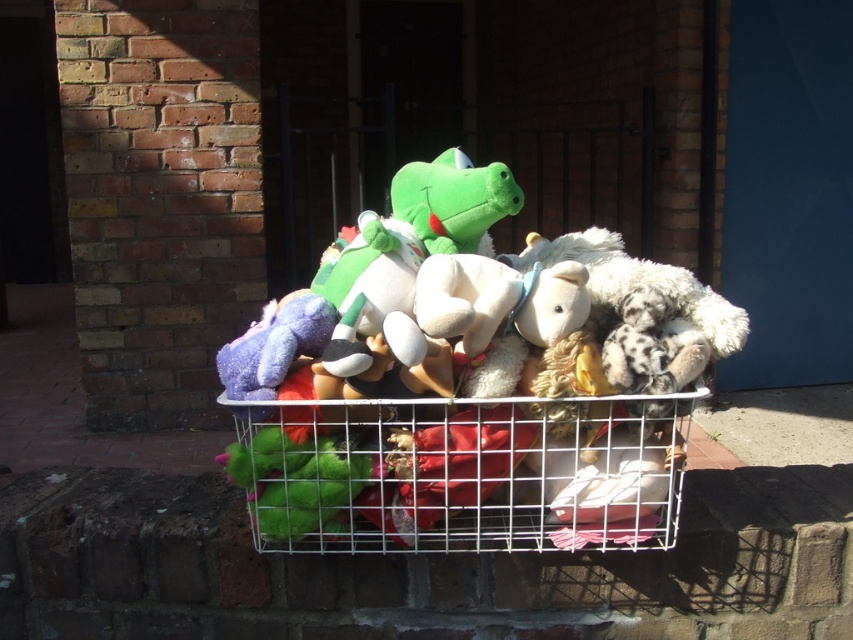
You are standing in front of a wire basket filled with stuffed toys and items on a brick ledge. You notice a specific point at coordinates [463,392]. What type of object is located at this point?

The point at coordinates [463,392] is on soft plush toys at center.

You are holding a camera and want to take a photo of the soft plush toys at center. If the camera requires a minimum distance of 30 inches to focus properly, will you be able to take a clear photo?

The soft plush toys at center and camera are 35.22 inches apart, which is more than the required 30 inches, so yes, you can take a clear photo.

You are trying to see the white wire shopping basket at center but the soft plush toys at center are blocking your view. Can you move the toys to get a clear look at the basket?

The soft plush toys at center are in front of the white wire shopping basket at center, so moving them would allow you to see the basket clearly.